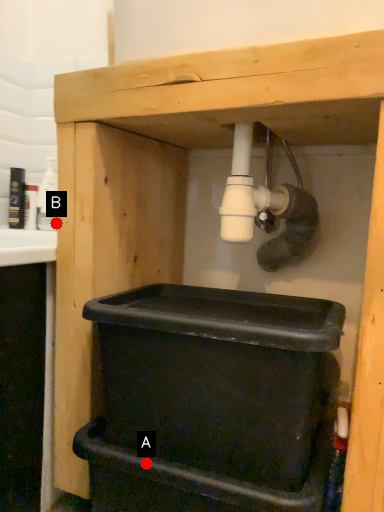
Question: Two points are circled on the image, labeled by A and B beside each circle. Which point appears closest to the camera in this image?

Choices:
 (A) A is closer
 (B) B is closer

Answer: (A)